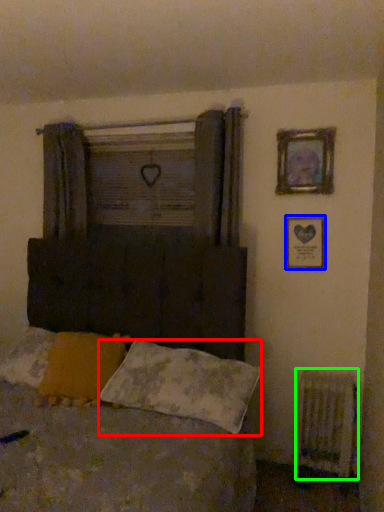
Question: Estimate the real-world distances between objects in this image. Which object is farther from pillow (highlighted by a red box), picture frame (highlighted by a blue box) or radiator (highlighted by a green box)?

Choices:
 (A) picture frame
 (B) radiator

Answer: (A)